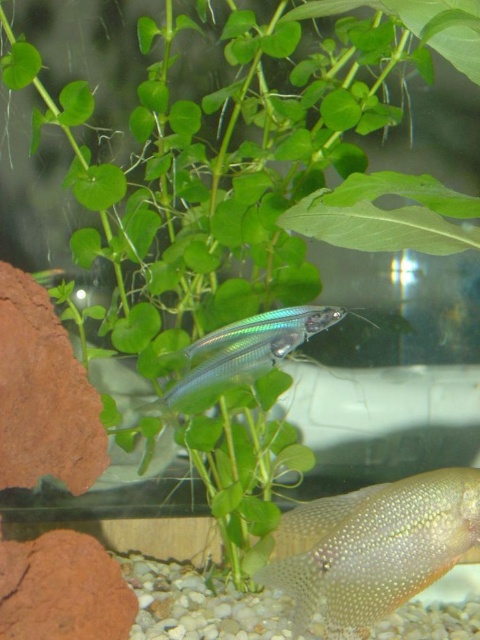
Question: Which of the following is the closest to the observer?

Choices:
 (A) (317, 593)
 (B) (276, 321)

Answer: (A)

Question: Which of the following is the closest to the observer?

Choices:
 (A) (195, 385)
 (B) (431, 566)

Answer: (B)

Question: Which of the following is the farthest from the observer?

Choices:
 (A) transparent glass fish at center
 (B) translucent glass fish at center

Answer: (A)

Question: Does translucent glass fish at center have a larger size compared to transparent glass fish at center?

Choices:
 (A) yes
 (B) no

Answer: (A)

Question: Is translucent glass fish at center positioned at the back of transparent glass fish at center?

Choices:
 (A) no
 (B) yes

Answer: (A)

Question: Is translucent glass fish at center bigger than transparent glass fish at center?

Choices:
 (A) yes
 (B) no

Answer: (A)